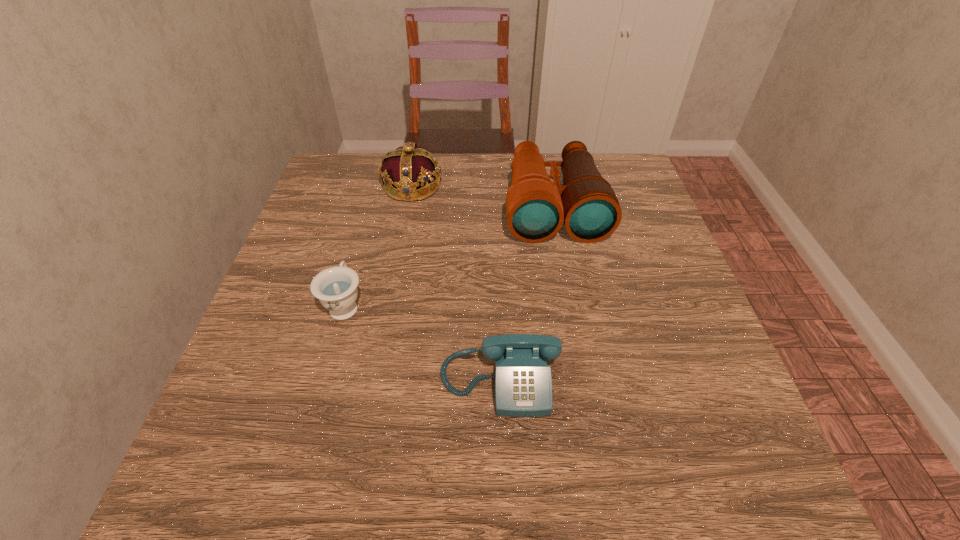
What are the coordinates of `blank region between the crown and the binoculars` in the screenshot? It's located at (483, 197).

Image resolution: width=960 pixels, height=540 pixels. Identify the location of empty space between the telephone and the teacup. (422, 342).

This screenshot has height=540, width=960. In order to click on object that stands as the third closest to the binoculars in this screenshot , I will do `click(336, 287)`.

Find the location of `object that is the third nearest to the crown`. object that is the third nearest to the crown is located at coordinates (523, 382).

What are the coordinates of `vacant region that satisfies the following two spatial constraints: 1. on the side of the crown with the handle; 2. on the left side of the second nearest object` in the screenshot? It's located at (378, 187).

This screenshot has width=960, height=540. What are the coordinates of `vacant area in the image that satisfies the following two spatial constraints: 1. on the side of the crown with the handle; 2. on the left side of the second nearest object` in the screenshot? It's located at (378, 187).